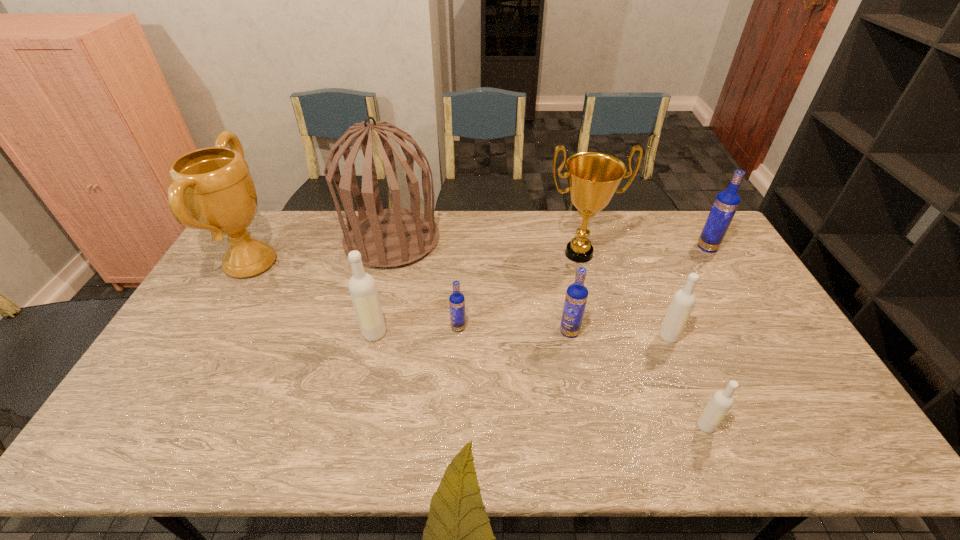
The image size is (960, 540). I want to click on vacant space located 0.200m on the left of the third vodka from left to right, so click(x=491, y=332).

Identify the location of free space located 0.070m on the right of the second vodka from left to right. (490, 328).

Locate an element on the screen. The image size is (960, 540). vacant space located 0.120m on the left of the nearest vodka is located at coordinates (647, 426).

Identify the location of birdcage present at the far edge. (385, 238).

Locate an element on the screen. vodka situated at the far edge is located at coordinates (726, 203).

At what (x,y) coordinates should I click in order to perform the action: click on object located in the near edge section of the desktop. Please return your answer as a coordinate pair (x, y). Looking at the image, I should click on (721, 402).

The width and height of the screenshot is (960, 540). Find the location of `object present at the left edge`. object present at the left edge is located at coordinates click(x=214, y=185).

Image resolution: width=960 pixels, height=540 pixels. I want to click on object located at the right edge, so click(726, 203).

The height and width of the screenshot is (540, 960). In order to click on object that is at the far left corner in this screenshot , I will do `click(214, 185)`.

In order to click on object that is at the far right corner in this screenshot , I will do `click(726, 203)`.